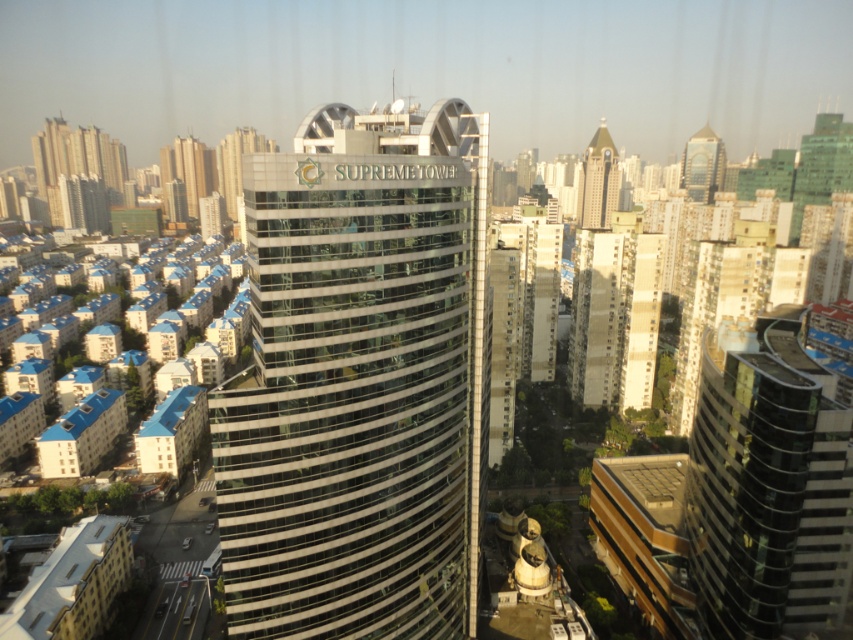
Question: Is glassy silver skyscraper at center further to the viewer compared to beige concrete building at center?

Choices:
 (A) no
 (B) yes

Answer: (A)

Question: Is glassy silver skyscraper at center behind glassy silver skyscraper at upper right?

Choices:
 (A) yes
 (B) no

Answer: (B)

Question: Which of the following is the farthest from the observer?

Choices:
 (A) black glass building at right
 (B) beige concrete building at center
 (C) glassy silver skyscraper at upper right

Answer: (C)

Question: Where is beige concrete building at center located in relation to glassy silver skyscraper at upper right in the image?

Choices:
 (A) right
 (B) left

Answer: (B)

Question: Which object is positioned closest to the glassy silver skyscraper at upper right?

Choices:
 (A) glassy silver skyscraper at center
 (B) glassy reflective skyscraper at upper right
 (C) beige concrete building at center
 (D) black glass building at right

Answer: (B)

Question: Among these objects, which one is nearest to the camera?

Choices:
 (A) beige concrete building at center
 (B) glassy silver skyscraper at upper right
 (C) glassy reflective skyscraper at upper right
 (D) black glass building at right

Answer: (D)